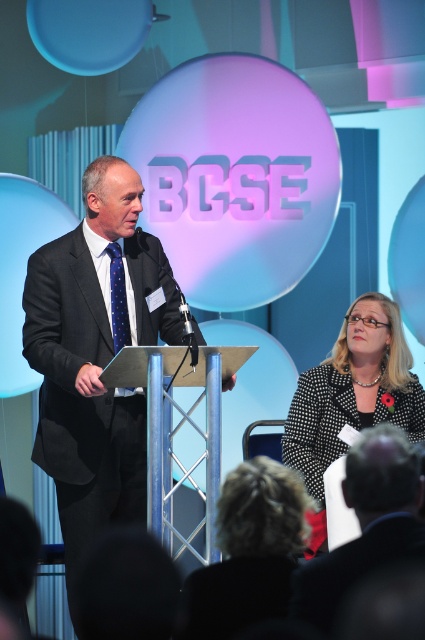
Question: Which object is farther from the camera taking this photo?

Choices:
 (A) dark gray suit at center
 (B) black suit at center
 (C) blue dotted tie at left

Answer: (C)

Question: Is black textured blazer at center positioned before blue dotted tie at left?

Choices:
 (A) yes
 (B) no

Answer: (B)

Question: Which object is farther from the camera taking this photo?

Choices:
 (A) dark gray suit at center
 (B) black textured blazer at center

Answer: (B)

Question: Which of the following is the farthest from the observer?

Choices:
 (A) (125, 301)
 (B) (70, 301)

Answer: (A)

Question: Is dark gray suit at center bigger than blue dotted tie at left?

Choices:
 (A) yes
 (B) no

Answer: (A)

Question: Does black suit at center appear under blue dotted tie at left?

Choices:
 (A) yes
 (B) no

Answer: (A)